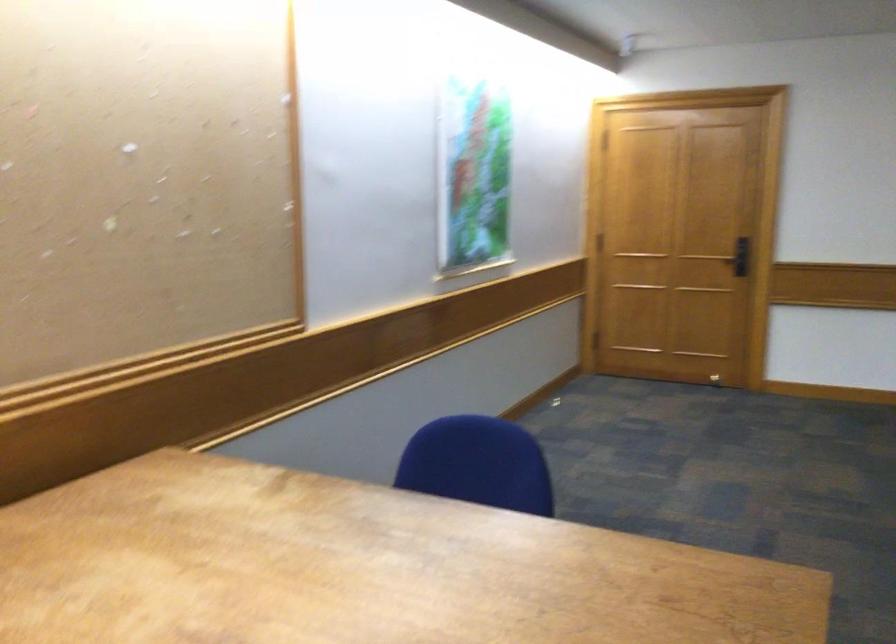
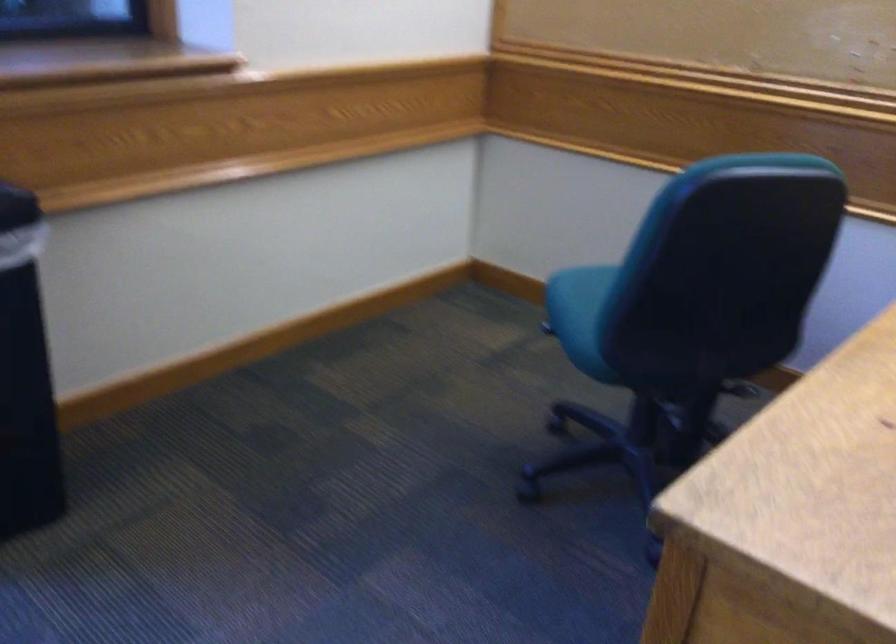
The first image is from the beginning of the video and the second image is from the end. How did the camera likely rotate when shooting the video?

The camera rotated toward left-down.